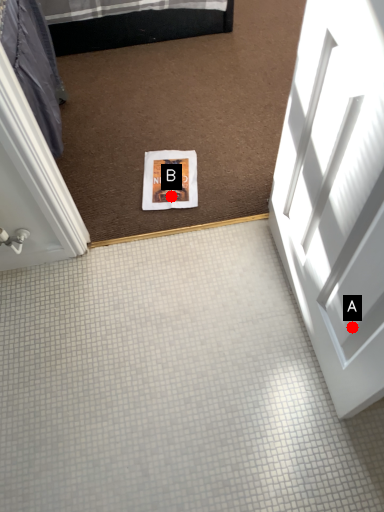
Question: Two points are circled on the image, labeled by A and B beside each circle. Which point appears closest to the camera in this image?

Choices:
 (A) A is closer
 (B) B is closer

Answer: (A)